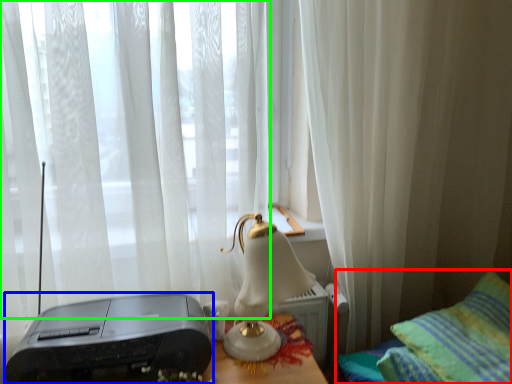
Question: Considering the real-world distances, which object is closest to furniture (highlighted by a red box)? printer (highlighted by a blue box) or curtain (highlighted by a green box).

Choices:
 (A) printer
 (B) curtain

Answer: (A)